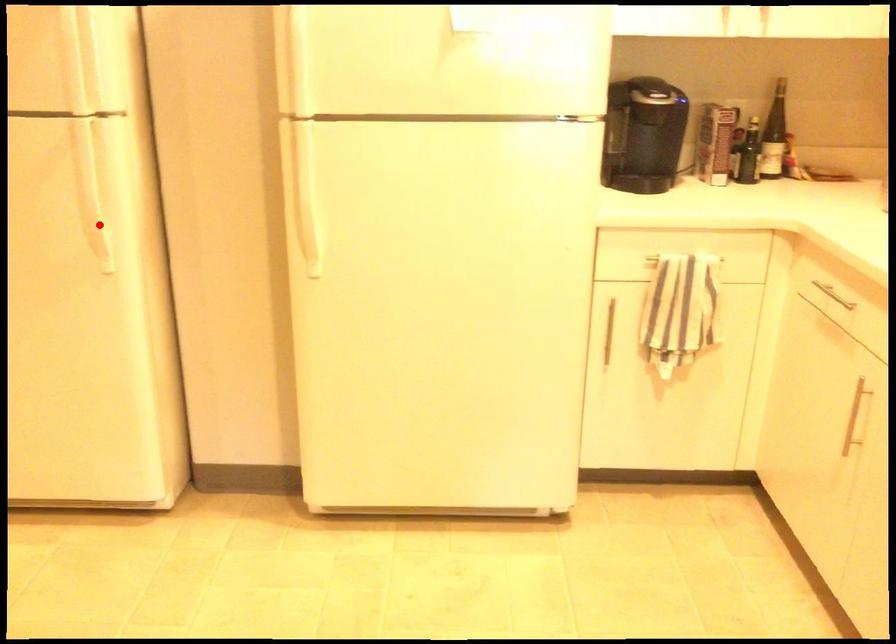
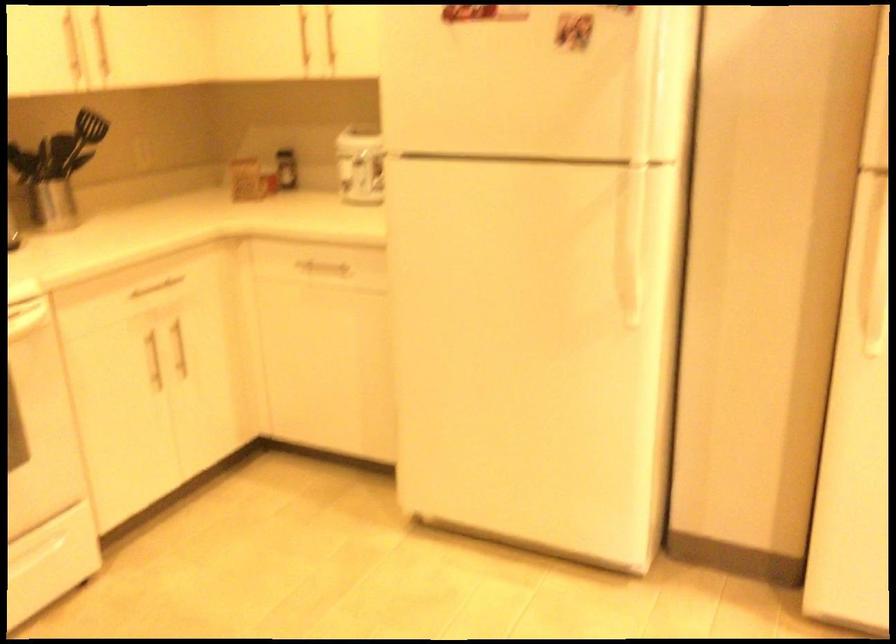
Find the pixel in the second image that matches the highlighted location in the first image.

(634, 277)